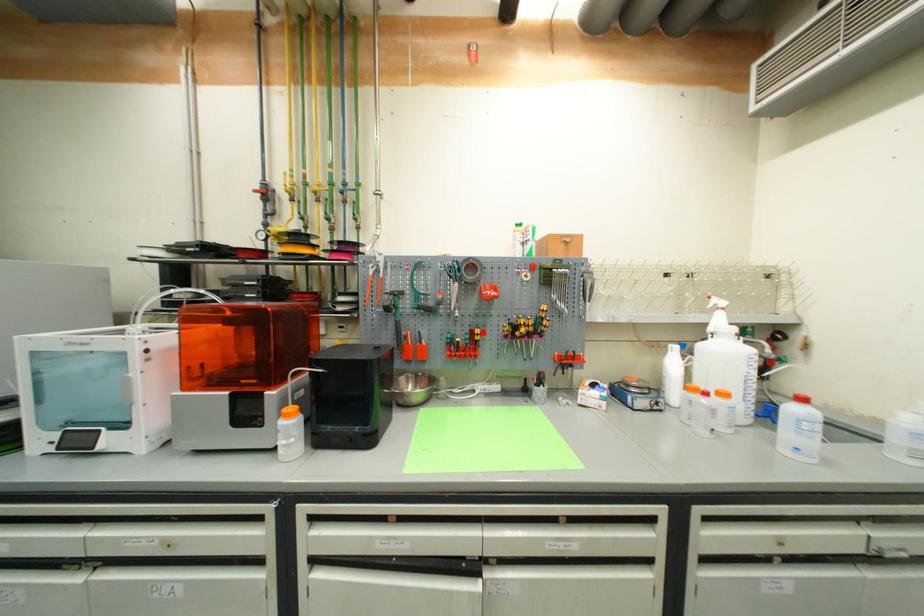
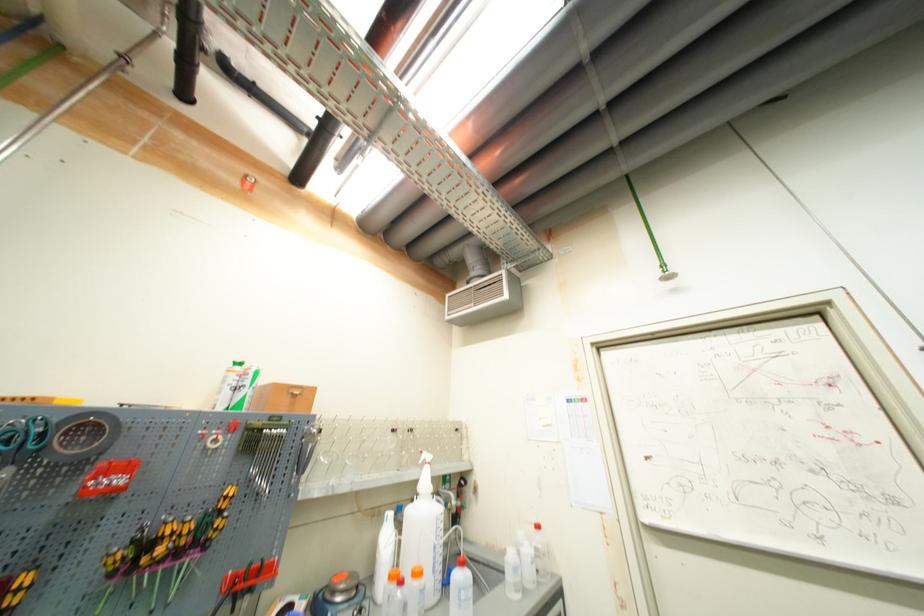
Locate, in the second image, the point that corresponds to the highlighted location in the first image.

(30, 581)